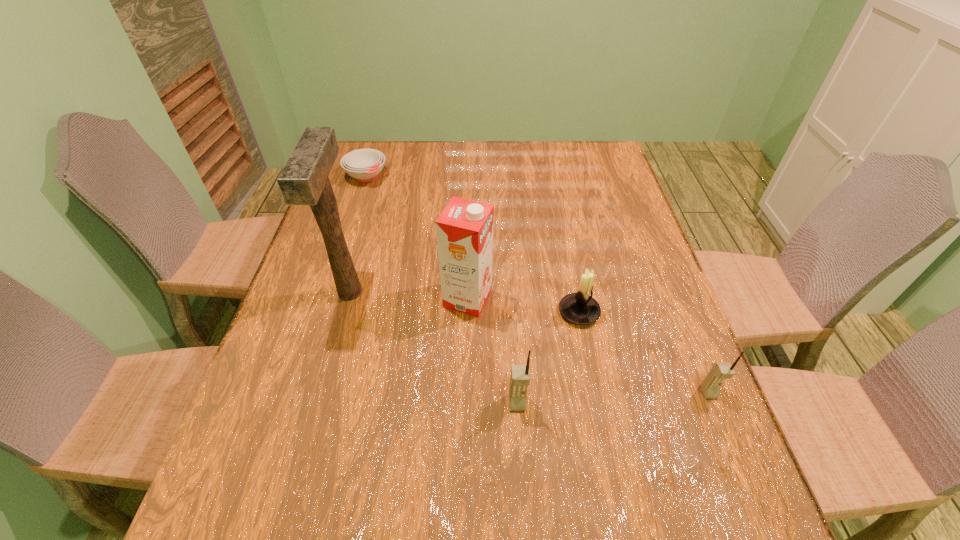
Identify the location of the left cellular telephone. (520, 374).

At what (x,y) coordinates should I click in order to perform the action: click on the taller cellular telephone. Please return your answer as a coordinate pair (x, y). Looking at the image, I should click on (520, 374).

Where is `the rightmost object`? The height and width of the screenshot is (540, 960). the rightmost object is located at coordinates (720, 371).

In order to click on the shorter cellular telephone in this screenshot , I will do `click(720, 371)`.

The width and height of the screenshot is (960, 540). I want to click on the shortest object, so click(x=364, y=165).

Where is `the farthest object`? The width and height of the screenshot is (960, 540). the farthest object is located at coordinates (364, 165).

Where is `carton`? carton is located at coordinates click(x=464, y=230).

I want to click on the second tallest object, so click(x=464, y=230).

You are a GUI agent. You are given a task and a screenshot of the screen. Output one action in this format:
    pyautogui.click(x=<x>, y=<y>)
    Task: Click on the mallet
    
    Given the screenshot: What is the action you would take?
    pyautogui.click(x=304, y=180)

In order to click on the second object from right to left in this screenshot , I will do `click(580, 308)`.